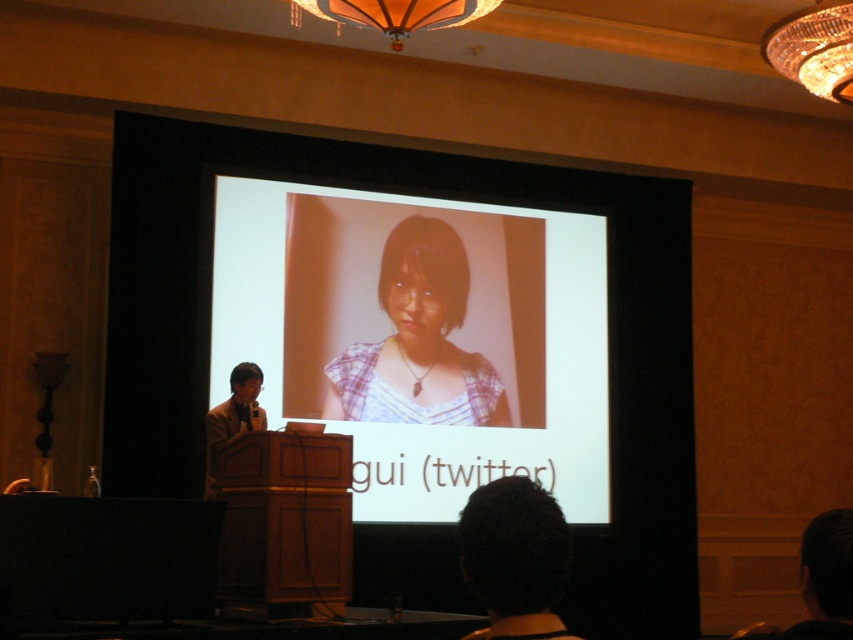
Question: Which of the following is the farthest from the observer?

Choices:
 (A) (505, 534)
 (B) (393, 392)
 (C) (448, 369)
 (D) (846, 67)

Answer: (C)

Question: Considering the real-world distances, which object is farthest from the crystal chandelier at upper right?

Choices:
 (A) dark brown hair at lower center
 (B) plaid fabric at center

Answer: (A)

Question: In this image, where is crystal chandelier at upper right located relative to orange fabric chandelier at upper center?

Choices:
 (A) above
 (B) below

Answer: (B)

Question: Can you confirm if white glossy projection screen at center is thinner than plaid fabric at center?

Choices:
 (A) no
 (B) yes

Answer: (A)

Question: Does plaid fabric at center appear on the right side of crystal chandelier at upper right?

Choices:
 (A) no
 (B) yes

Answer: (A)

Question: Which object is positioned farthest from the plaid fabric at center?

Choices:
 (A) crystal chandelier at upper right
 (B) orange fabric chandelier at upper center
 (C) white glossy projection screen at center
 (D) dark brown hair at lower center

Answer: (D)